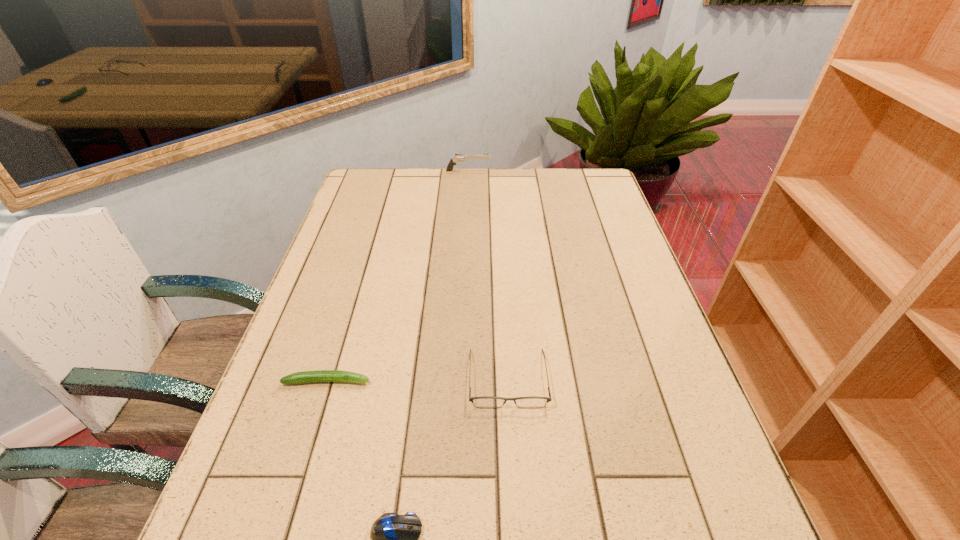
Image resolution: width=960 pixels, height=540 pixels. Identify the location of free location at the left edge. (316, 305).

In the image, there is a desktop. What are the coordinates of `vacant space at the right edge` in the screenshot? It's located at (671, 411).

Locate an element on the screen. The width and height of the screenshot is (960, 540). empty location between the farthest object and the zucchini is located at coordinates (397, 276).

Find the location of a particular element. The width and height of the screenshot is (960, 540). free spot between the farthest object and the spectacles is located at coordinates (489, 275).

Locate an element on the screen. This screenshot has width=960, height=540. free space between the spectacles and the zucchini is located at coordinates (418, 380).

Find the location of a particular element. The height and width of the screenshot is (540, 960). object that is the second closest to the third shortest object is located at coordinates (320, 375).

Identify which object is the second nearest to the farthest object. Please provide its 2D coordinates. Your answer should be formatted as a tuple, i.e. [(x, y)], where the tuple contains the x and y coordinates of a point satisfying the conditions above.

[(320, 375)]

This screenshot has width=960, height=540. I want to click on free space that satisfies the following two spatial constraints: 1. on the front-facing side of the third shortest object; 2. on the front-facing side of the leftmost object, so click(x=508, y=381).